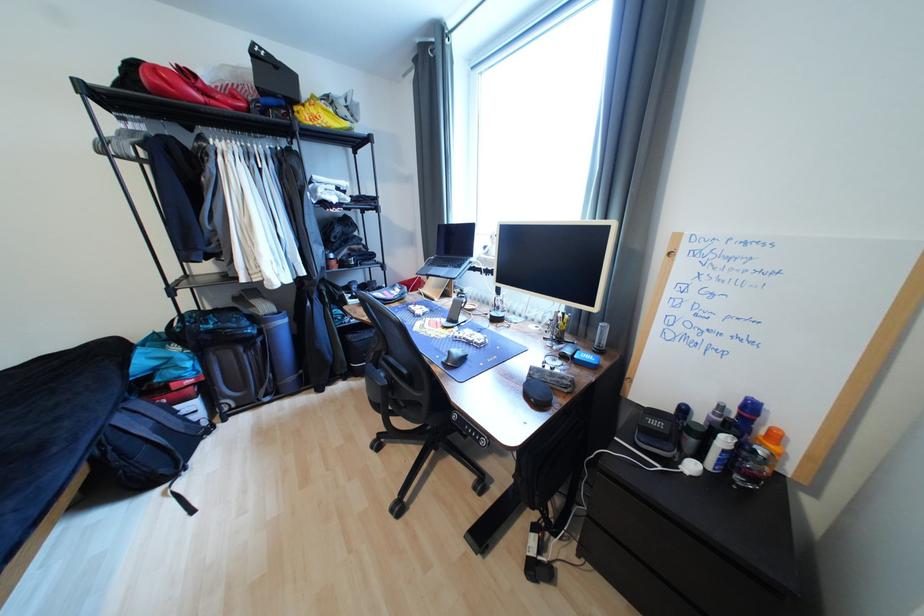
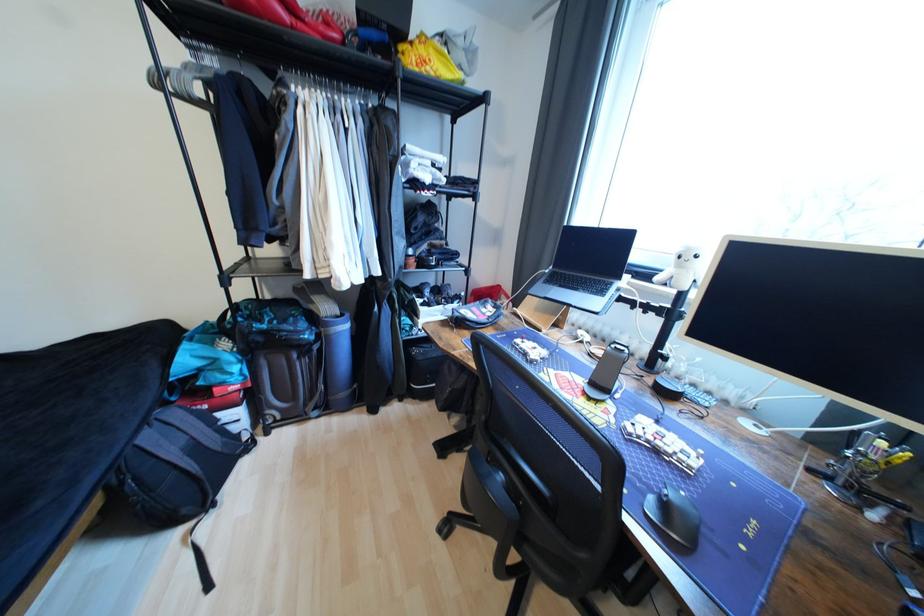
Find the pixel in the second image that matches point (467, 339) in the first image.

(646, 438)